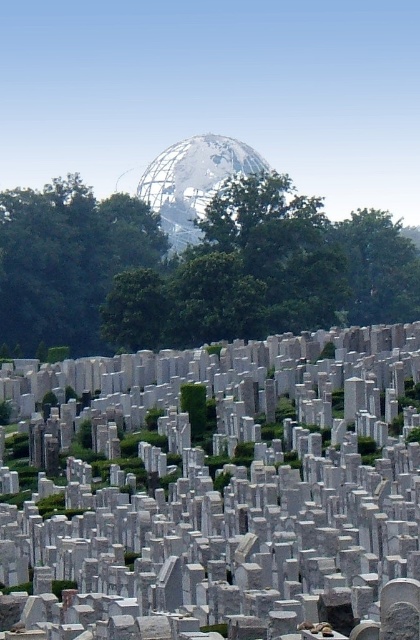
You are standing at the entrance of the cemetery and want to locate the green leafy tree at upper center. According to the image coordinates, where should you look?

You should look at point 0.422 on the x axis and 0.457 on the y axis to find the green leafy tree at upper center.

You are a landscape architect planning to install a new pathway between the white marble gravestone at center and the green leafy tree at upper center. Considering their widths, which one might require more space to accommodate on either side?

The green leafy tree at upper center requires more space because its width is greater than the white marble gravestone at center.

From the picture: You are standing in the cemetery and want to take a photo of the green leafy tree at upper center. If your camera has a maximum zoom range of 100 meters, will you be able to capture the tree clearly in the photo?

The green leafy tree at upper center is 188.87 meters from viewer, which exceeds the camera maximum zoom range of 100 meters. Therefore, you cannot capture the tree clearly in the photo.